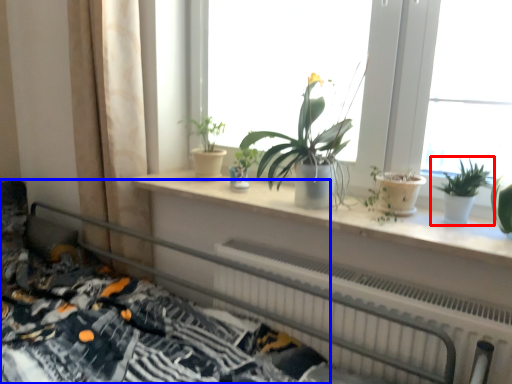
Question: Which object appears farthest to the camera in this image, houseplant (highlighted by a red box) or bed (highlighted by a blue box)?

Choices:
 (A) houseplant
 (B) bed

Answer: (A)